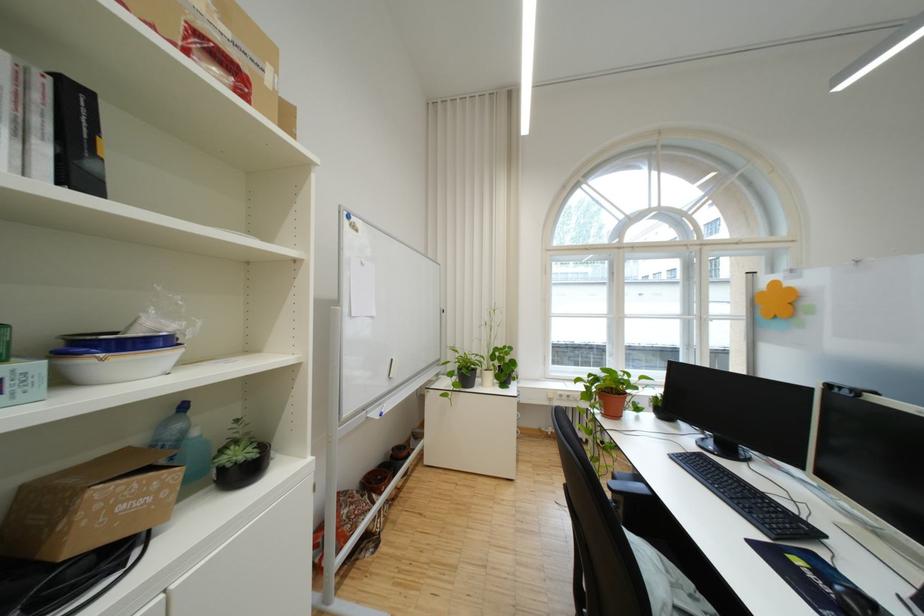
This screenshot has width=924, height=616. What do you see at coordinates (626, 488) in the screenshot?
I see `the chair armrest` at bounding box center [626, 488].